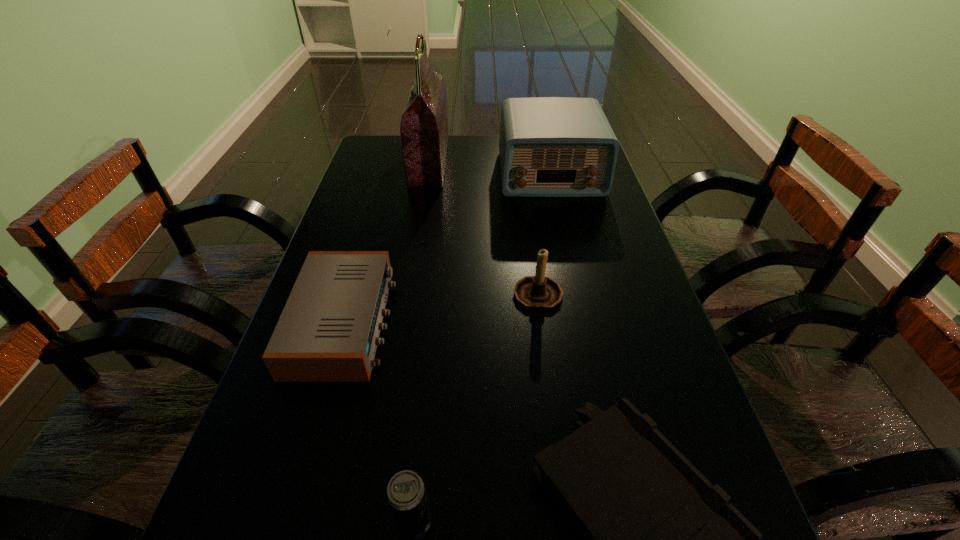
I want to click on vacant space located on the back of the beer can, so click(426, 392).

Where is `vacant space located 0.320m on the front panel of the left radio receiver`? vacant space located 0.320m on the front panel of the left radio receiver is located at coordinates (541, 322).

Where is `handbag at the far edge`? Image resolution: width=960 pixels, height=540 pixels. handbag at the far edge is located at coordinates point(424,134).

What are the coordinates of `radio receiver that is at the far edge` in the screenshot? It's located at (549, 146).

Locate an element on the screen. object at the left edge is located at coordinates (328, 331).

You are a GUI agent. You are given a task and a screenshot of the screen. Output one action in this format:
    pyautogui.click(x=<x>, y=<y>)
    Task: Click on the object that is at the right edge
    This screenshot has height=540, width=960.
    Given the screenshot: What is the action you would take?
    pyautogui.click(x=549, y=146)

Image resolution: width=960 pixels, height=540 pixels. Find the location of `object located in the far right corner section of the desktop`. object located in the far right corner section of the desktop is located at coordinates (549, 146).

Locate an element on the screen. The height and width of the screenshot is (540, 960). vacant space at the far edge of the desktop is located at coordinates (474, 145).

Where is `blank space at the left edge of the desktop`? blank space at the left edge of the desktop is located at coordinates (x=262, y=413).

The height and width of the screenshot is (540, 960). Find the location of `vacant space at the right edge of the desktop`. vacant space at the right edge of the desktop is located at coordinates (609, 386).